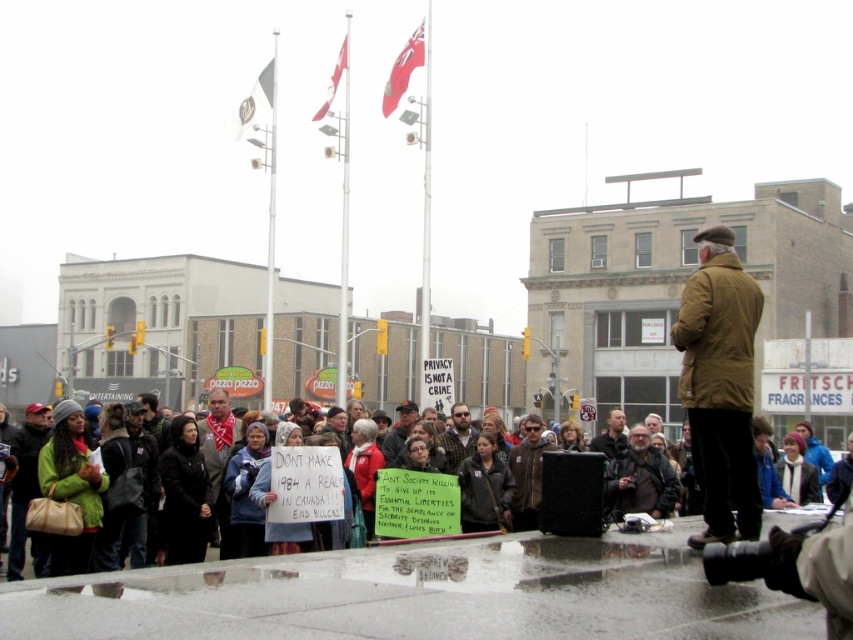
Question: Which of the following is the closest to the observer?

Choices:
 (A) green fabric jacket at lower left
 (B) gray wool scarf at center
 (C) bearded man at center
 (D) brown leather jacket at center

Answer: (D)

Question: Can you confirm if brown leather jacket at center is thinner than gray wool scarf at center?

Choices:
 (A) no
 (B) yes

Answer: (B)

Question: Does bearded man at center appear on the left side of dark gray jacket at center?

Choices:
 (A) no
 (B) yes

Answer: (A)

Question: Based on their relative distances, which object is farther from the dark gray wool coat at lower left?

Choices:
 (A) brown leather jacket at center
 (B) green fabric jacket at lower left
 (C) bearded man at center
 (D) gray wool scarf at center

Answer: (B)

Question: Is dark brown leather jacket at center smaller than green fabric jacket at lower left?

Choices:
 (A) yes
 (B) no

Answer: (A)

Question: Based on their relative distances, which object is nearer to the bearded man at center?

Choices:
 (A) dark brown leather jacket at center
 (B) brown leather jacket at center
 (C) green fabric jacket at lower left

Answer: (A)